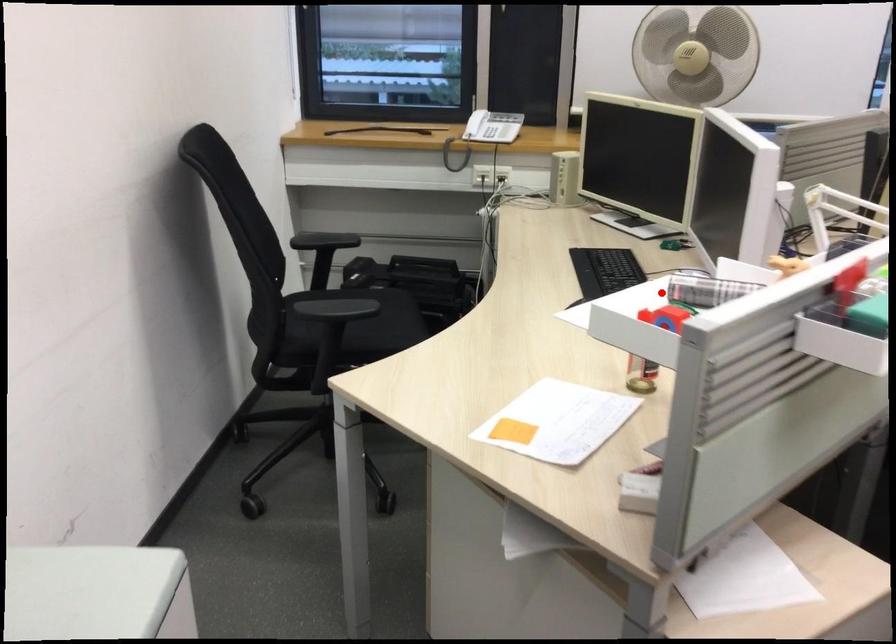
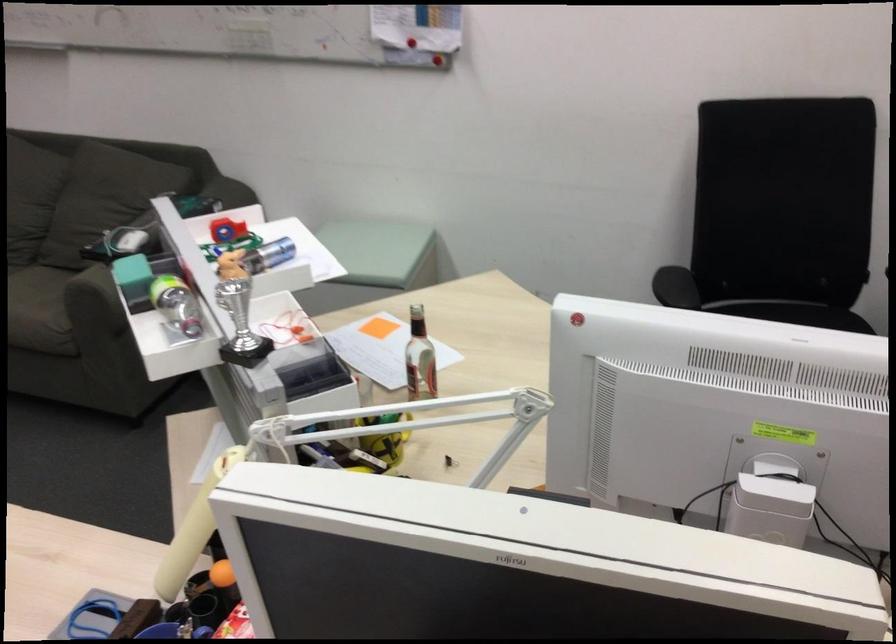
The point at the highlighted location is marked in the first image. Where is the corresponding point in the second image?

(274, 252)